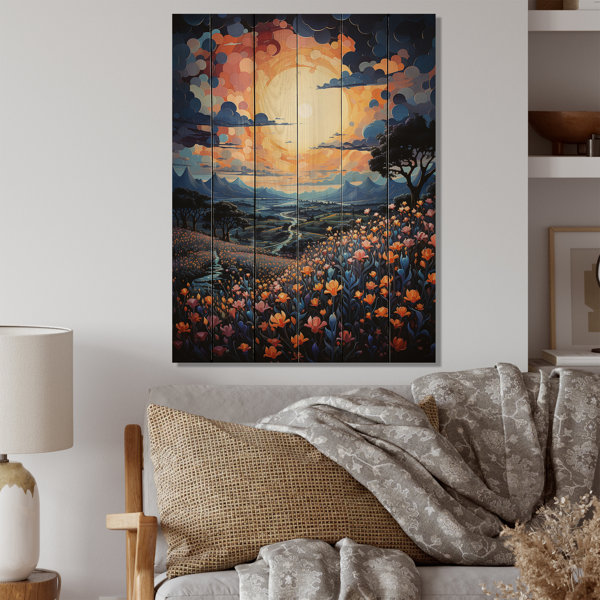
Locate an element on the screen. white couch is located at coordinates (208, 581), (443, 580).